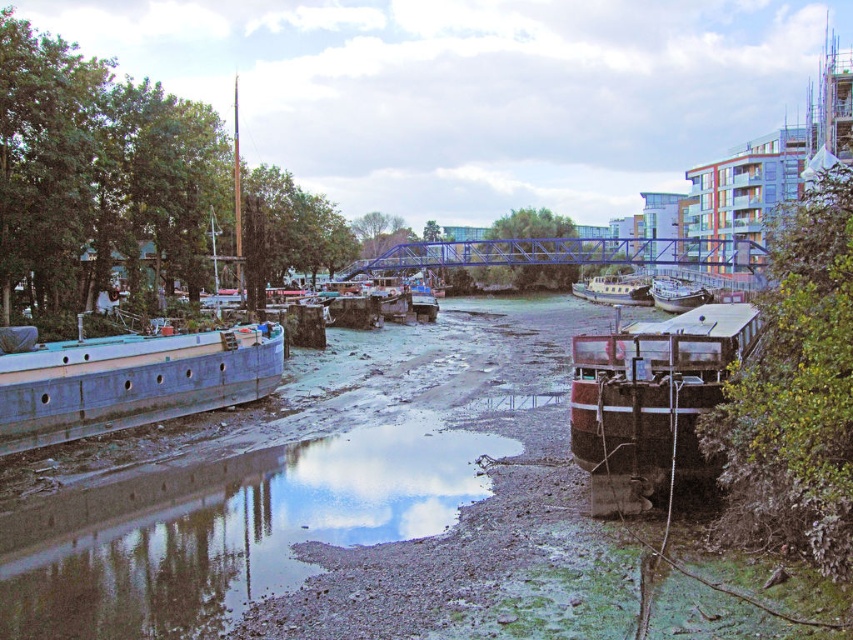
You are standing on the blue matte barge at left and want to walk to the muddy gravel river at center. Which direction should you move in?

You should move to your right to reach the muddy gravel river at center because the muddy gravel river at center is to the right of the blue matte barge at left.

You are standing at the point labeled point (229, 531) in the image. Based on the scene description, what type of terrain are you likely standing on?

The point (229, 531) corresponds to muddy gravel river at center, so you are standing on muddy gravel river terrain.